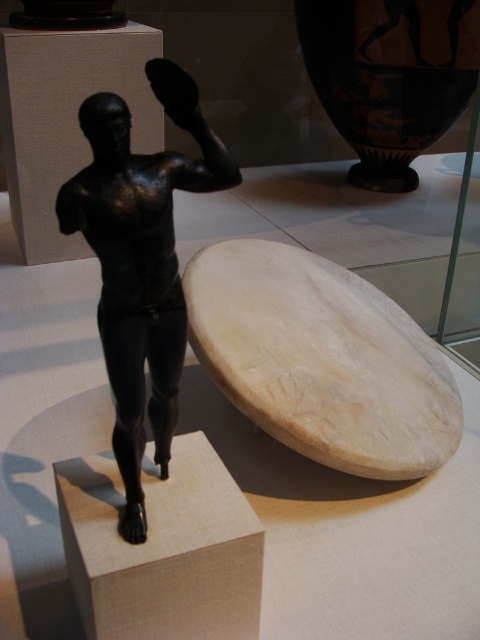
Between white marble surfboard at lower center and shiny black statue at center, which one is positioned higher?

shiny black statue at center is higher up.

Between white marble surfboard at lower center and shiny black statue at center, which one appears on the right side from the viewer's perspective?

From the viewer's perspective, white marble surfboard at lower center appears more on the right side.

Is point (320, 381) positioned after point (87, 140)?

No, (320, 381) is closer to viewer.

Find the location of a particular element. The height and width of the screenshot is (640, 480). white marble surfboard at lower center is located at coordinates (322, 358).